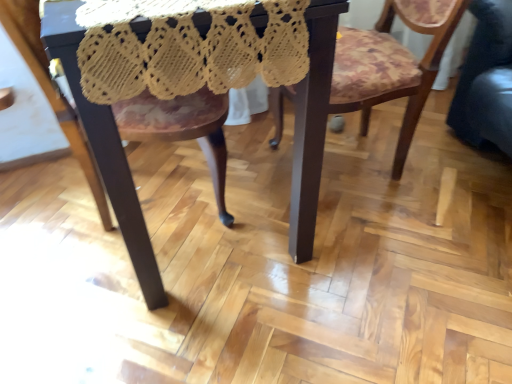
Question: Is wooden chair at center, acting as the second chair starting from the right, spatially inside wooden floral-patterned chair at center, acting as the second chair starting from the left, or outside of it?

Choices:
 (A) outside
 (B) inside

Answer: (A)

Question: Is wooden chair at center, which is counted as the first chair, starting from the left, in front of or behind wooden floral-patterned chair at center, acting as the second chair starting from the left, in the image?

Choices:
 (A) behind
 (B) front

Answer: (B)

Question: Based on their relative distances, which object is nearer to the yellow crochet lace at center?

Choices:
 (A) dark brown polished wood table at center
 (B) wooden chair at center, which is counted as the first chair, starting from the left
 (C) wooden floral-patterned chair at center, the first chair viewed from the right

Answer: (A)

Question: Which object is positioned farthest from the yellow crochet lace at center?

Choices:
 (A) wooden floral-patterned chair at center, the first chair viewed from the right
 (B) dark brown polished wood table at center
 (C) wooden chair at center, which is counted as the first chair, starting from the left

Answer: (A)